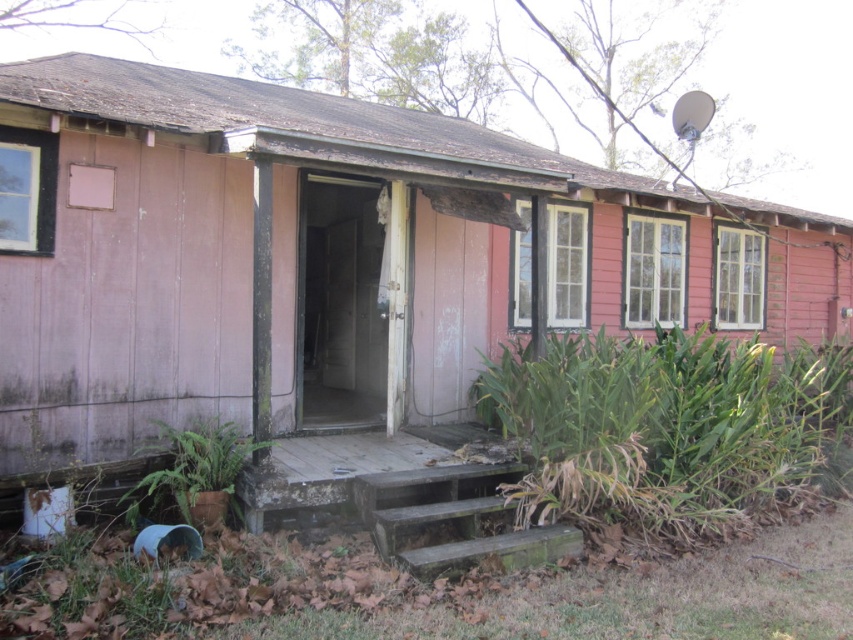
Question: Which object appears farthest from the camera in this image?

Choices:
 (A) dark green concrete stairs at center
 (B) green leafy plant at lower right
 (C) pink wood house at center
 (D) green leafy plant at lower left

Answer: (B)

Question: Is green leafy plant at lower right below green leafy plant at lower left?

Choices:
 (A) no
 (B) yes

Answer: (A)

Question: Observing the image, what is the correct spatial positioning of pink wood house at center in reference to green leafy plant at lower right?

Choices:
 (A) right
 (B) left

Answer: (B)

Question: Which object is farther from the camera taking this photo?

Choices:
 (A) green leafy plant at lower right
 (B) pink wood house at center
 (C) dark green concrete stairs at center
 (D) green leafy plant at lower left

Answer: (A)

Question: Estimate the real-world distances between objects in this image. Which object is farther from the dark green concrete stairs at center?

Choices:
 (A) green leafy plant at lower left
 (B) pink wood house at center
 (C) green leafy plant at lower right

Answer: (B)

Question: Is dark green concrete stairs at center below green leafy plant at lower left?

Choices:
 (A) no
 (B) yes

Answer: (B)